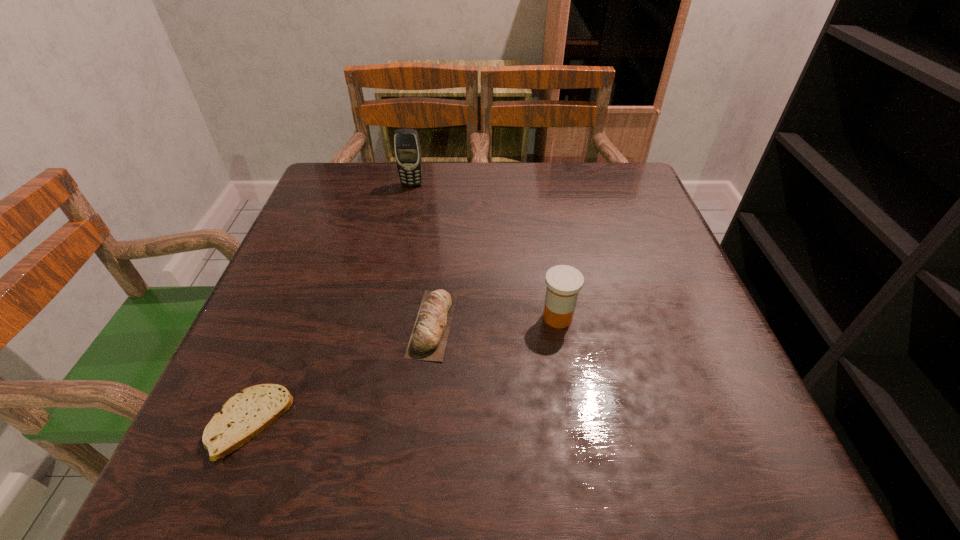
Identify the location of blank region between the tallest object and the second object from right to left. The height and width of the screenshot is (540, 960). (422, 254).

The width and height of the screenshot is (960, 540). What are the coordinates of `vacant area between the taller pita bread and the cellular telephone` in the screenshot? It's located at 422,254.

I want to click on empty space that is in between the third shortest object and the shortest object, so click(x=403, y=370).

The width and height of the screenshot is (960, 540). I want to click on free point between the nearest object and the right pita bread, so click(342, 374).

Identify the location of free spot between the medicine and the nearer pita bread. (403, 370).

Identify the location of object identified as the closest to the shorter pita bread. The width and height of the screenshot is (960, 540). (428, 340).

Find the location of a particular element. The width and height of the screenshot is (960, 540). the closest object to the third object from right to left is located at coordinates (428, 340).

Image resolution: width=960 pixels, height=540 pixels. Find the location of `free region that satisfies the following two spatial constraints: 1. on the back side of the nearer pita bread; 2. on the left side of the taller pita bread`. free region that satisfies the following two spatial constraints: 1. on the back side of the nearer pita bread; 2. on the left side of the taller pita bread is located at coordinates (289, 324).